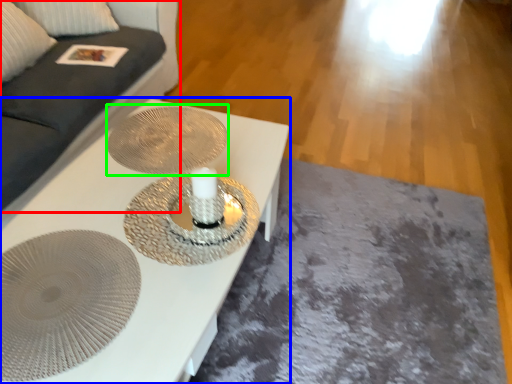
Question: Based on their relative distances, which object is nearer to couch (highlighted by a red box)? Choose from table (highlighted by a blue box) and oval (highlighted by a green box).

Choices:
 (A) table
 (B) oval

Answer: (B)